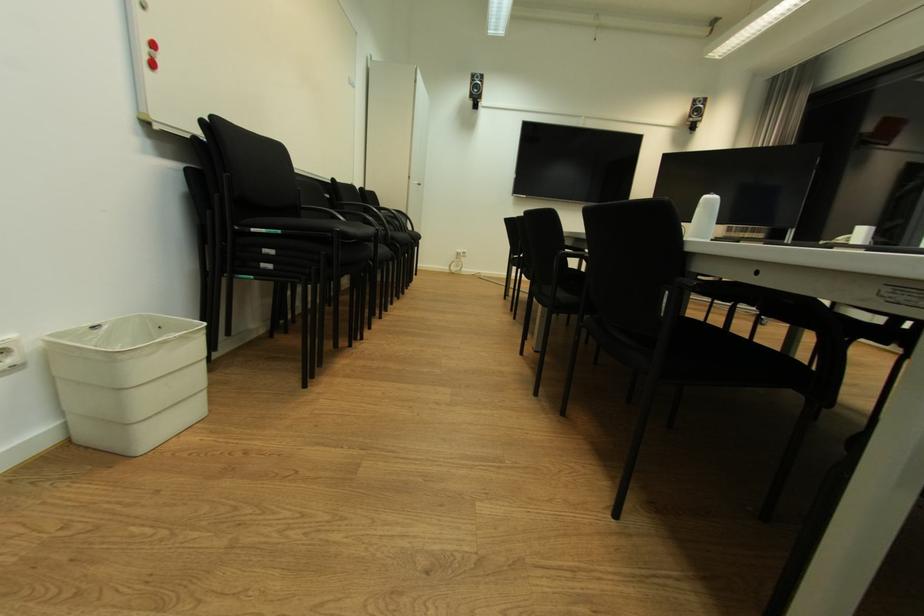
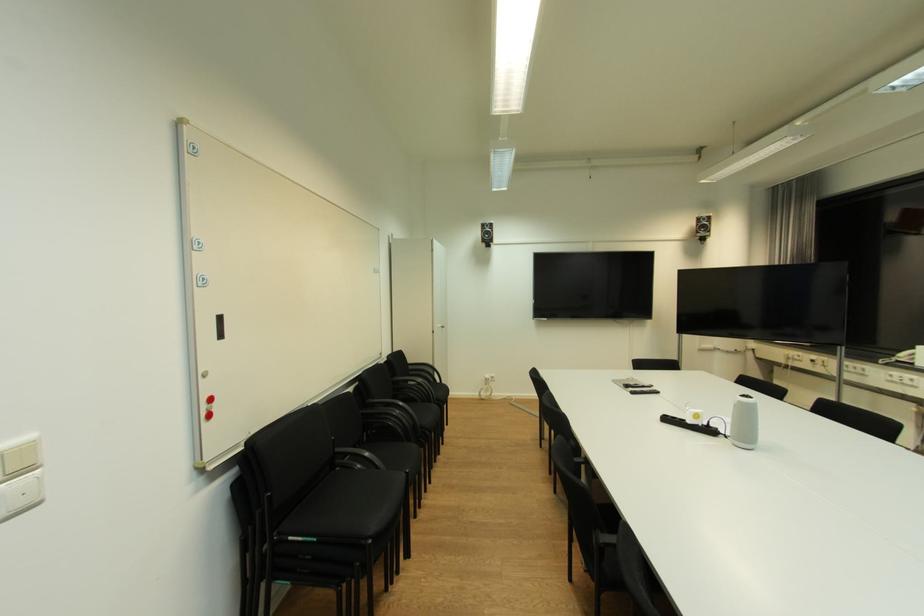
The point at (700, 114) is marked in the first image. Where is the corresponding point in the second image?

(708, 231)